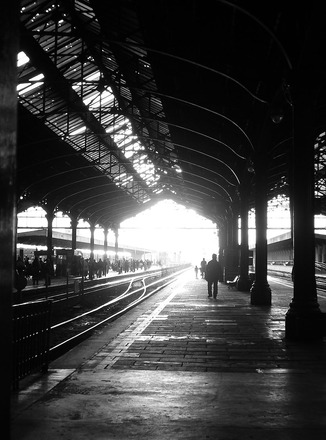
I want to click on ceiling, so click(x=175, y=128).